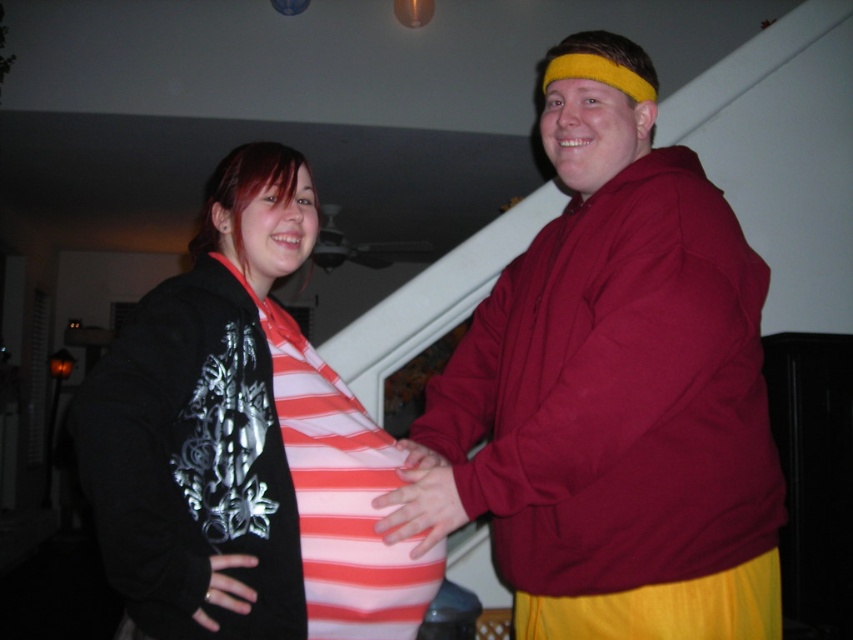
Question: Estimate the real-world distances between objects in this image. Which object is closer to the striped fabric shirt at center?

Choices:
 (A) pink fabric hand at center
 (B) maroon hoodie at center
 (C) black matte ring at lower left

Answer: (A)

Question: Is the position of maroon hoodie at center more distant than that of black matte ring at lower left?

Choices:
 (A) no
 (B) yes

Answer: (B)

Question: Which point is farther from the camera taking this photo?

Choices:
 (A) (393, 499)
 (B) (595, 132)

Answer: (B)

Question: Is maroon hoodie at center thinner than pink fabric hand at center?

Choices:
 (A) no
 (B) yes

Answer: (A)

Question: Which point appears closest to the camera in this image?

Choices:
 (A) (399, 440)
 (B) (213, 628)
 (C) (695, 200)

Answer: (B)

Question: Can you confirm if striped fabric shirt at center is positioned below pink fabric hand at center?

Choices:
 (A) yes
 (B) no

Answer: (B)